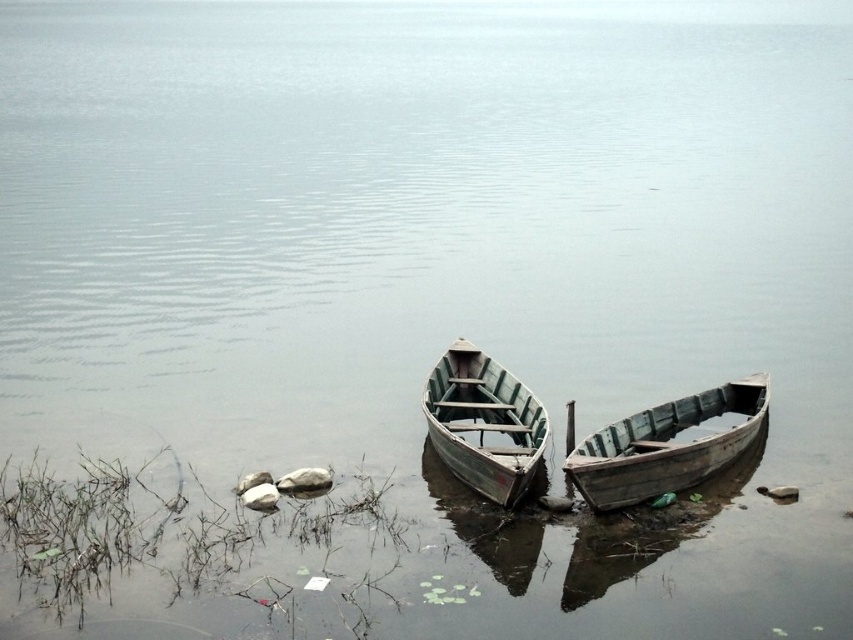
You are standing on the lakeshore and want to estimate how far the wooden canoe at lower right is from you. Based on the scene, can you determine the distance?

The wooden canoe at lower right is 12.46 meters away from the viewer.

You are standing on the lakeshore and want to board the wooden canoe at lower right and the green wooden canoe at center. Which boat should you approach first if you want to board the one closer to the shore?

The wooden canoe at lower right is positioned on the right side of the green wooden canoe at center, so the wooden canoe at lower right is closer to the shore and should be boarded first.

You are standing at the shore looking at the two points marked on the image. Which point, point (634, 477) or point (434, 417), is closer to you?

Point (634, 477) is closer to the viewer than point (434, 417).